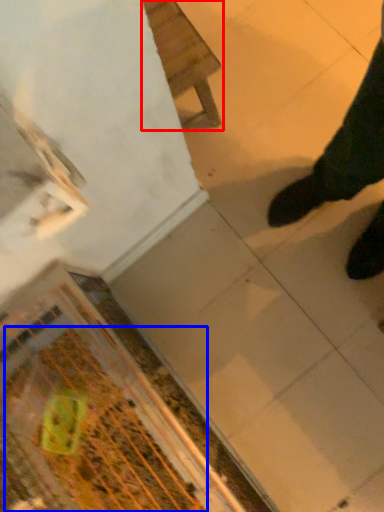
Question: Which object appears closest to the camera in this image, furniture (highlighted by a red box) or debris (highlighted by a blue box)?

Choices:
 (A) furniture
 (B) debris

Answer: (B)